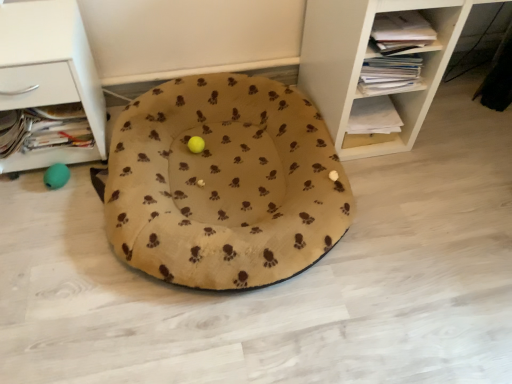
Question: Is white matte drawer at left, positioned as the 2th shelf in right-to-left order, at the back of white wood shelf at upper right, which is counted as the 1th shelf, starting from the right?

Choices:
 (A) no
 (B) yes

Answer: (A)

Question: Does white wood shelf at upper right, which is counted as the 1th shelf, starting from the right, have a smaller size compared to white matte drawer at left, which is counted as the 1th shelf, starting from the left?

Choices:
 (A) yes
 (B) no

Answer: (B)

Question: Can you confirm if white wood shelf at upper right, which ranks as the second shelf in left-to-right order, is wider than white matte drawer at left, positioned as the 2th shelf in right-to-left order?

Choices:
 (A) no
 (B) yes

Answer: (B)

Question: From a real-world perspective, does white wood shelf at upper right, which is counted as the 1th shelf, starting from the right, sit lower than white matte drawer at left, positioned as the 2th shelf in right-to-left order?

Choices:
 (A) yes
 (B) no

Answer: (B)

Question: Can you confirm if white wood shelf at upper right, which ranks as the second shelf in left-to-right order, is positioned to the right of white matte drawer at left, positioned as the 2th shelf in right-to-left order?

Choices:
 (A) yes
 (B) no

Answer: (A)

Question: Is white wood shelf at upper right, which ranks as the second shelf in left-to-right order, thinner than white matte drawer at left, positioned as the 2th shelf in right-to-left order?

Choices:
 (A) no
 (B) yes

Answer: (A)

Question: Can you confirm if beige fleece dog bed at center is wider than white matte drawer at left, which is counted as the 1th shelf, starting from the left?

Choices:
 (A) yes
 (B) no

Answer: (A)

Question: Does beige fleece dog bed at center have a smaller size compared to white matte drawer at left, positioned as the 2th shelf in right-to-left order?

Choices:
 (A) no
 (B) yes

Answer: (A)

Question: Does beige fleece dog bed at center come in front of white matte drawer at left, which is counted as the 1th shelf, starting from the left?

Choices:
 (A) no
 (B) yes

Answer: (B)

Question: From a real-world perspective, does beige fleece dog bed at center sit lower than white matte drawer at left, positioned as the 2th shelf in right-to-left order?

Choices:
 (A) no
 (B) yes

Answer: (B)

Question: Can you confirm if beige fleece dog bed at center is thinner than white matte drawer at left, positioned as the 2th shelf in right-to-left order?

Choices:
 (A) yes
 (B) no

Answer: (B)

Question: Can you confirm if beige fleece dog bed at center is bigger than white matte drawer at left, which is counted as the 1th shelf, starting from the left?

Choices:
 (A) yes
 (B) no

Answer: (A)

Question: Is white wood shelf at upper right, which ranks as the second shelf in left-to-right order, further to camera compared to beige fleece dog bed at center?

Choices:
 (A) no
 (B) yes

Answer: (A)